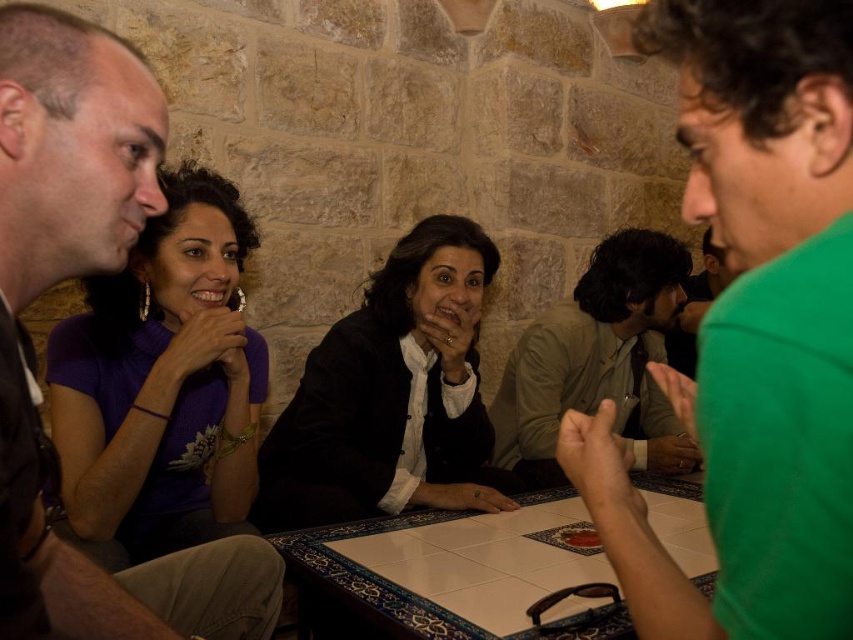
The image size is (853, 640). Describe the element at coordinates (163, 381) in the screenshot. I see `purple matte shirt at left` at that location.

Who is positioned more to the right, purple matte shirt at left or khaki cotton shirt at center?

From the viewer's perspective, khaki cotton shirt at center appears more on the right side.

This screenshot has height=640, width=853. Identify the location of purple matte shirt at left. (163, 381).

Does white tile table at center have a lesser width compared to khaki cotton shirt at center?

No, white tile table at center is not thinner than khaki cotton shirt at center.

Who is shorter, white tile table at center or khaki cotton shirt at center?

With less height is white tile table at center.

What do you see at coordinates (448, 572) in the screenshot?
I see `white tile table at center` at bounding box center [448, 572].

Locate an element on the screen. white tile table at center is located at coordinates (448, 572).

Locate an element on the screen. The image size is (853, 640). matte black jacket at center is located at coordinates click(x=390, y=394).

Between matte black jacket at center and khaki cotton shirt at center, which one appears on the right side from the viewer's perspective?

From the viewer's perspective, khaki cotton shirt at center appears more on the right side.

Find the location of `matte black jacket at center`. matte black jacket at center is located at coordinates (390, 394).